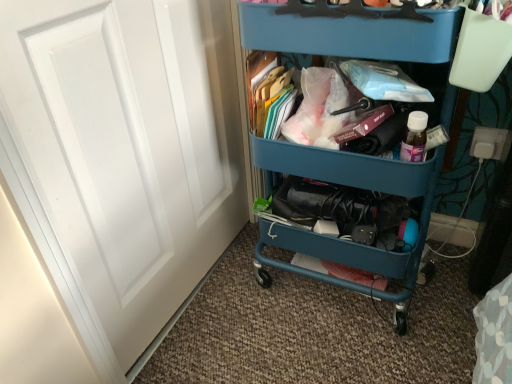
Question: From the image's perspective, is white matte door at left on top of teal plastic cart at center?

Choices:
 (A) yes
 (B) no

Answer: (B)

Question: Is white matte door at left wider than teal plastic cart at center?

Choices:
 (A) yes
 (B) no

Answer: (B)

Question: Does white matte door at left have a smaller size compared to teal plastic cart at center?

Choices:
 (A) yes
 (B) no

Answer: (A)

Question: Is white matte door at left beside teal plastic cart at center?

Choices:
 (A) yes
 (B) no

Answer: (B)

Question: From a real-world perspective, is white matte door at left beneath teal plastic cart at center?

Choices:
 (A) yes
 (B) no

Answer: (B)

Question: Could you tell me if white matte door at left is facing teal plastic cart at center?

Choices:
 (A) no
 (B) yes

Answer: (B)

Question: Would you say blue plastic cart at upper center contains white matte door at left?

Choices:
 (A) no
 (B) yes

Answer: (A)

Question: Does blue plastic cart at upper center appear on the left side of white matte door at left?

Choices:
 (A) yes
 (B) no

Answer: (B)

Question: From a real-world perspective, is blue plastic cart at upper center below white matte door at left?

Choices:
 (A) yes
 (B) no

Answer: (B)

Question: Is blue plastic cart at upper center positioned before white matte door at left?

Choices:
 (A) yes
 (B) no

Answer: (B)

Question: Is blue plastic cart at upper center completely or partially outside of white matte door at left?

Choices:
 (A) no
 (B) yes

Answer: (B)

Question: From the image's perspective, does blue plastic cart at upper center appear higher than white matte door at left?

Choices:
 (A) yes
 (B) no

Answer: (A)

Question: Can you confirm if teal plastic cart at center is wider than white matte door at left?

Choices:
 (A) yes
 (B) no

Answer: (A)